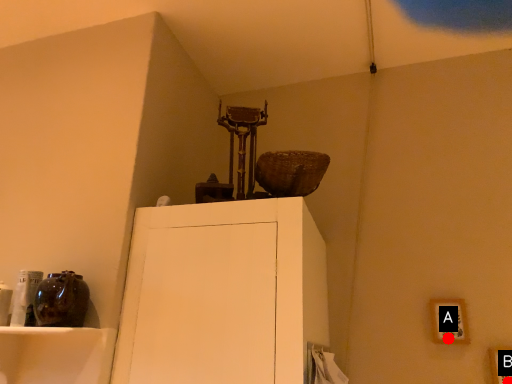
Question: Two points are circled on the image, labeled by A and B beside each circle. Which point is farther from the camera taking this photo?

Choices:
 (A) A is further
 (B) B is further

Answer: (A)